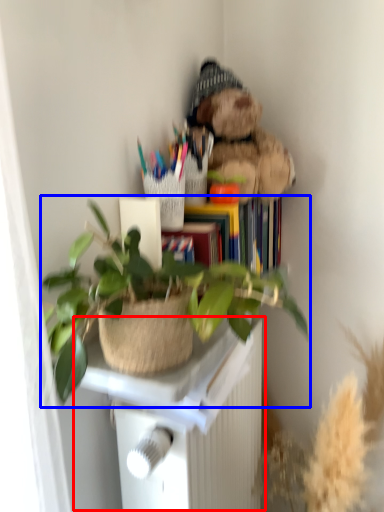
Question: Among these objects, which one is nearest to the camera, table (highlighted by a red box) or houseplant (highlighted by a blue box)?

Choices:
 (A) table
 (B) houseplant

Answer: (B)